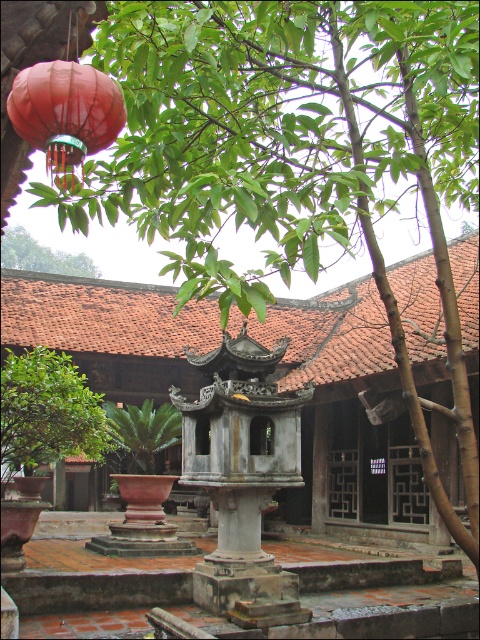
Can you confirm if matte red lantern at upper left is positioned above green leafy tree at upper center?

Incorrect, matte red lantern at upper left is not positioned above green leafy tree at upper center.

Locate an element on the screen. matte red lantern at upper left is located at coordinates (66, 115).

Find the location of a particular element. This screenshot has height=640, width=480. matte red lantern at upper left is located at coordinates (66, 115).

Does green leafy tree at lower left have a larger size compared to matte red lantern at upper left?

Incorrect, green leafy tree at lower left is not larger than matte red lantern at upper left.

Consider the image. How far apart are green leafy tree at lower left and matte red lantern at upper left?

green leafy tree at lower left and matte red lantern at upper left are 8.39 meters apart from each other.

At what (x,y) coordinates should I click in order to perform the action: click on green leafy tree at lower left. Please return your answer as a coordinate pair (x, y). Looking at the image, I should click on (47, 412).

Where is `green leafy tree at lower left`? Image resolution: width=480 pixels, height=640 pixels. green leafy tree at lower left is located at coordinates (47, 412).

Does matte red lantern at upper left have a greater width compared to green leafy plant at center?

Incorrect, matte red lantern at upper left's width does not surpass green leafy plant at center's.

Measure the distance between matte red lantern at upper left and green leafy plant at center.

matte red lantern at upper left and green leafy plant at center are 11.13 meters apart from each other.

Which is behind, point (87, 129) or point (153, 417)?

Positioned behind is point (153, 417).

The height and width of the screenshot is (640, 480). I want to click on matte red lantern at upper left, so 66,115.